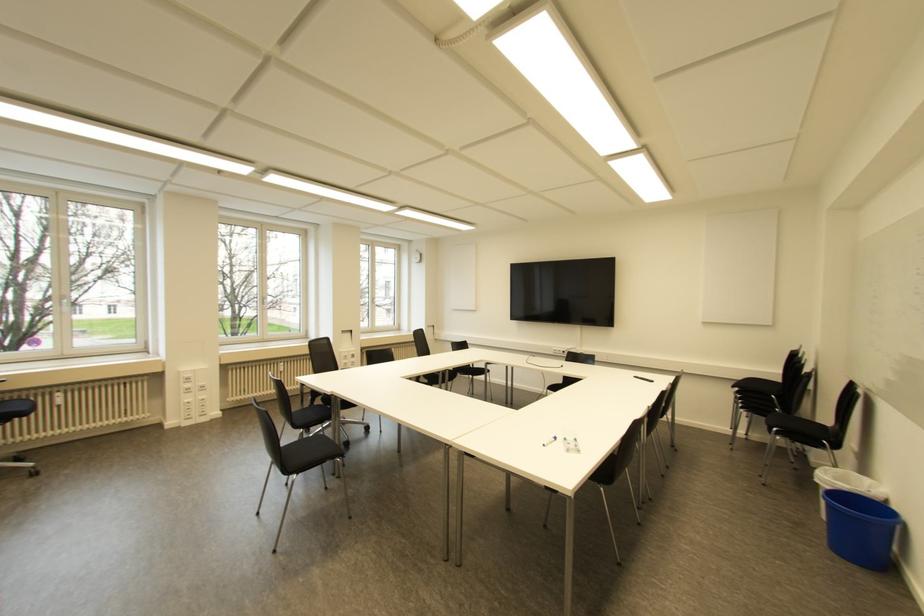
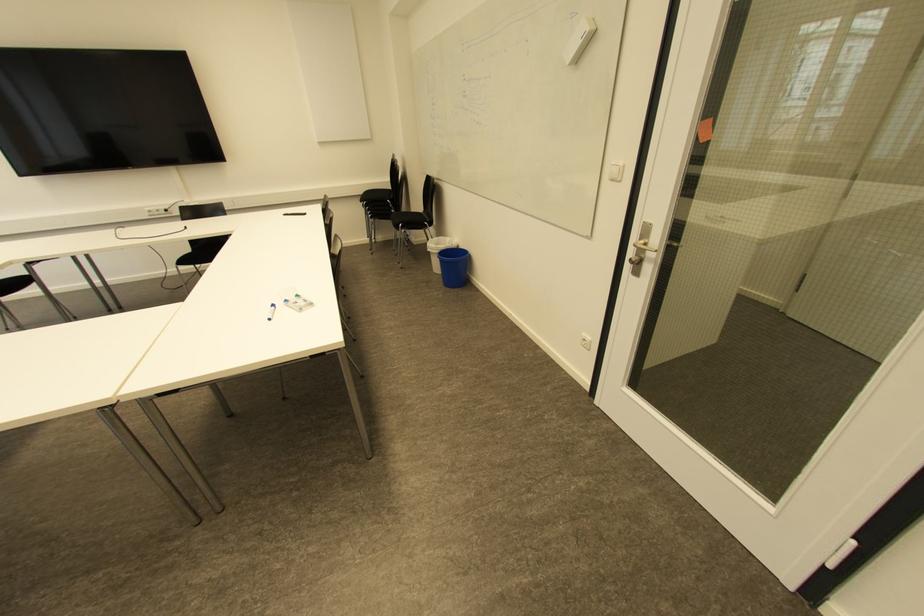
Find the pixel in the second image that matches (829,477) in the first image.

(434, 245)